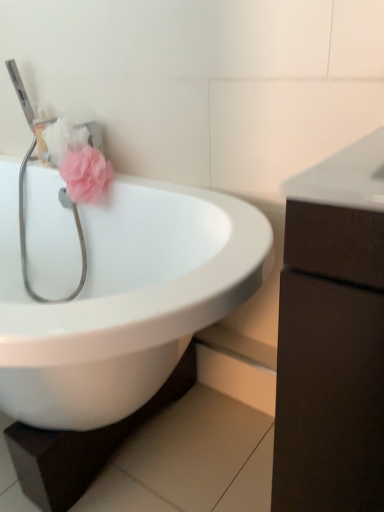
Question: Can you confirm if white glossy sink at center is bigger than dark brown wood cabinet at right?

Choices:
 (A) yes
 (B) no

Answer: (A)

Question: Is white glossy sink at center far from dark brown wood cabinet at right?

Choices:
 (A) yes
 (B) no

Answer: (B)

Question: Considering the relative positions of white glossy sink at center and dark brown wood cabinet at right in the image provided, is white glossy sink at center to the right of dark brown wood cabinet at right from the viewer's perspective?

Choices:
 (A) no
 (B) yes

Answer: (A)

Question: From the image's perspective, would you say white glossy sink at center is positioned over dark brown wood cabinet at right?

Choices:
 (A) no
 (B) yes

Answer: (B)

Question: Is white glossy sink at center to the left of dark brown wood cabinet at right from the viewer's perspective?

Choices:
 (A) yes
 (B) no

Answer: (A)

Question: Visually, is pink fabric flower at upper left positioned to the left or to the right of dark brown wood cabinet at right?

Choices:
 (A) left
 (B) right

Answer: (A)

Question: From a real-world perspective, is pink fabric flower at upper left above or below dark brown wood cabinet at right?

Choices:
 (A) above
 (B) below

Answer: (A)

Question: Considering the positions of point 77,201 and point 377,209, is point 77,201 closer or farther from the camera than point 377,209?

Choices:
 (A) closer
 (B) farther

Answer: (B)

Question: Is pink fabric flower at upper left in front of or behind dark brown wood cabinet at right in the image?

Choices:
 (A) behind
 (B) front

Answer: (A)

Question: Is point (195, 285) closer or farther from the camera than point (81, 282)?

Choices:
 (A) farther
 (B) closer

Answer: (B)

Question: Considering the positions of white glossy sink at center and metallic silver stethoscope at left in the image, is white glossy sink at center taller or shorter than metallic silver stethoscope at left?

Choices:
 (A) short
 (B) tall

Answer: (B)

Question: Looking at the image, does white glossy sink at center seem bigger or smaller compared to metallic silver stethoscope at left?

Choices:
 (A) big
 (B) small

Answer: (A)

Question: Visually, is white glossy sink at center positioned to the left or to the right of metallic silver stethoscope at left?

Choices:
 (A) left
 (B) right

Answer: (A)

Question: Which is correct: white glossy sink at center is inside pink fabric flower at upper left, or outside of it?

Choices:
 (A) inside
 (B) outside

Answer: (B)

Question: In terms of height, does white glossy sink at center look taller or shorter compared to pink fabric flower at upper left?

Choices:
 (A) tall
 (B) short

Answer: (A)